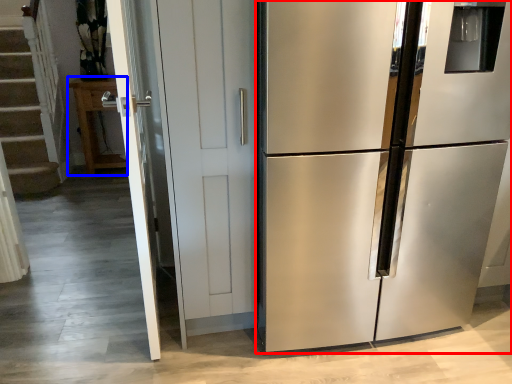
Question: Among these objects, which one is nearest to the camera, refrigerator (highlighted by a red box) or cabinetry (highlighted by a blue box)?

Choices:
 (A) refrigerator
 (B) cabinetry

Answer: (A)